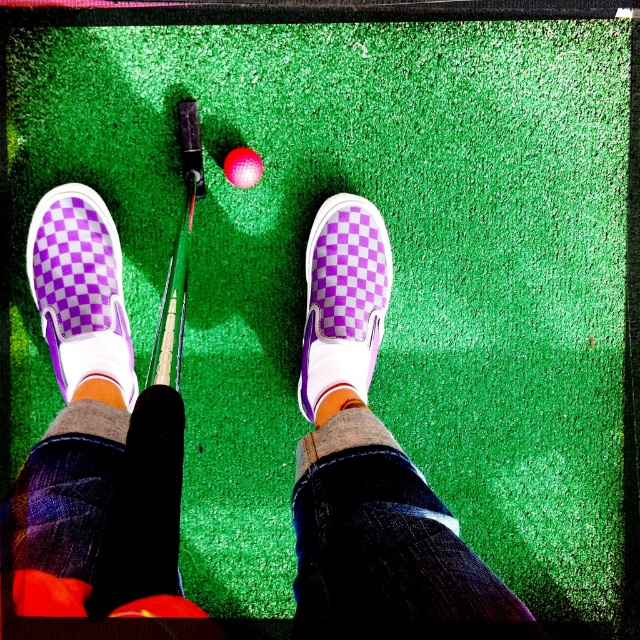
Does metallic silver golf club at center come behind matte pink golf ball at center?

No, metallic silver golf club at center is in front of matte pink golf ball at center.

At what (x,y) coordinates should I click in order to perform the action: click on metallic silver golf club at center. Please return your answer as a coordinate pair (x, y). Image resolution: width=640 pixels, height=640 pixels. Looking at the image, I should click on (179, 256).

Is purple checkered slip-on at left smaller than metallic silver golf club at center?

Yes.

Measure the distance from purple checkered slip-on at left to metallic silver golf club at center.

purple checkered slip-on at left and metallic silver golf club at center are 10.72 inches apart from each other.

The height and width of the screenshot is (640, 640). Identify the location of purple checkered slip-on at left. (81, 291).

Which is above, purple checkered slip-on at left or purple checkered slip-on shoe at center?

purple checkered slip-on at left

Which is more to the right, purple checkered slip-on at left or purple checkered slip-on shoe at center?

From the viewer's perspective, purple checkered slip-on shoe at center appears more on the right side.

Find the location of a particular element. The width and height of the screenshot is (640, 640). purple checkered slip-on at left is located at coordinates (81, 291).